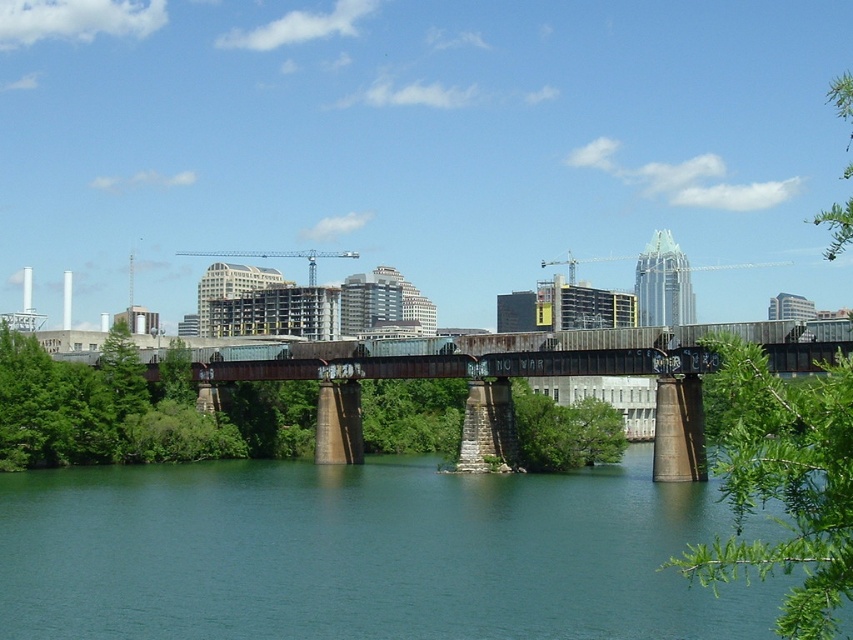
Which of these two, green smooth water at center or green leafy tree at upper right, stands taller?

green leafy tree at upper right is taller.

Is green smooth water at center positioned in front of green leafy tree at upper right?

No, green smooth water at center is further to the viewer.

Identify the location of green smooth water at center. This screenshot has height=640, width=853. (363, 554).

I want to click on green smooth water at center, so click(x=363, y=554).